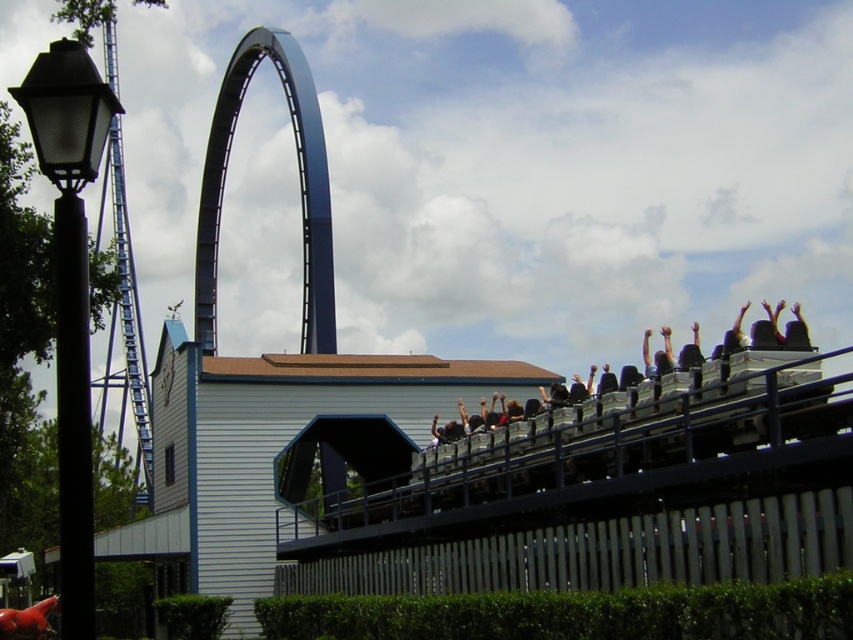
You are a photographer planning to capture a photo of the green leafy hedge at lower center and the matte black seats at upper right in the amusement park scene. Based on their heights, which object will appear taller in the final photograph?

The green leafy hedge at lower center will appear taller in the photograph because it has a greater height compared to the matte black seats at upper right.